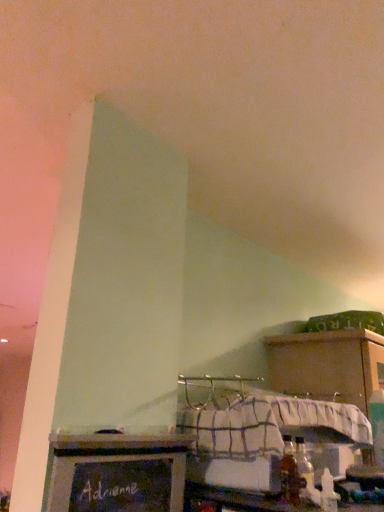
Question: In terms of width, does chalkboard sign at lower center look wider or thinner when compared to wooden at upper right?

Choices:
 (A) wide
 (B) thin

Answer: (B)

Question: Does point [x=59, y=502] appear closer or farther from the camera than point [x=286, y=380]?

Choices:
 (A) farther
 (B) closer

Answer: (B)

Question: In terms of height, does chalkboard sign at lower center look taller or shorter compared to wooden at upper right?

Choices:
 (A) tall
 (B) short

Answer: (B)

Question: Looking at the image, does wooden at upper right seem bigger or smaller compared to chalkboard sign at lower center?

Choices:
 (A) small
 (B) big

Answer: (B)

Question: Is point (299, 382) closer or farther from the camera than point (183, 464)?

Choices:
 (A) farther
 (B) closer

Answer: (A)

Question: Visually, is wooden at upper right positioned to the left or to the right of chalkboard sign at lower center?

Choices:
 (A) right
 (B) left

Answer: (A)

Question: Which is correct: wooden at upper right is inside chalkboard sign at lower center, or outside of it?

Choices:
 (A) inside
 (B) outside

Answer: (B)